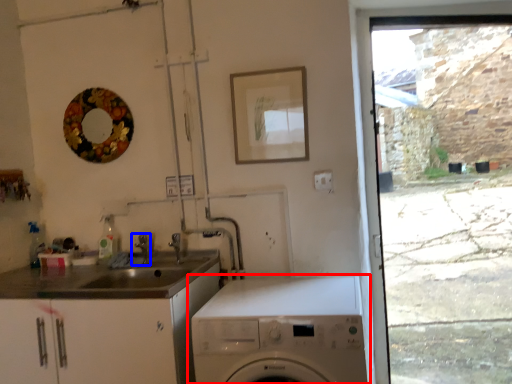
Question: Which of the following is the closest to the observer, washing machine (highlighted by a red box) or tap (highlighted by a blue box)?

Choices:
 (A) washing machine
 (B) tap

Answer: (A)